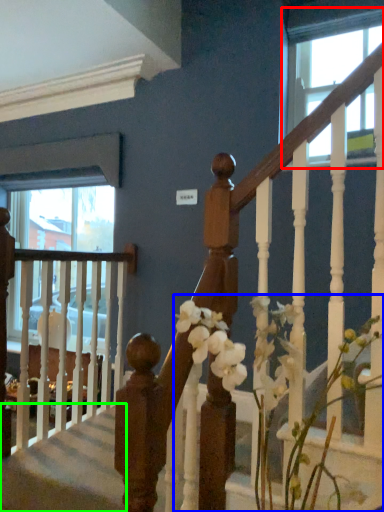
Question: Which object is positioned farthest from window (highlighted by a red box)? Select from floral arrangement (highlighted by a blue box) and stairwell (highlighted by a green box).

Choices:
 (A) floral arrangement
 (B) stairwell

Answer: (B)